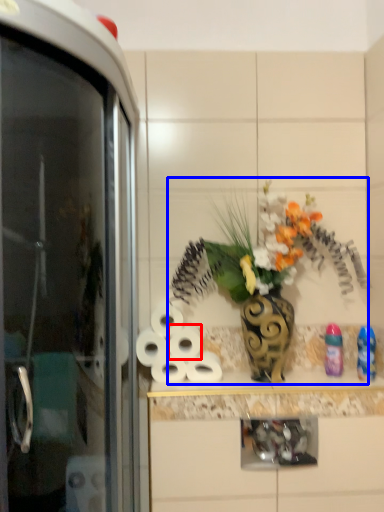
Question: Among these objects, which one is farthest to the camera, toilet paper (highlighted by a red box) or floral arrangement (highlighted by a blue box)?

Choices:
 (A) toilet paper
 (B) floral arrangement

Answer: (A)